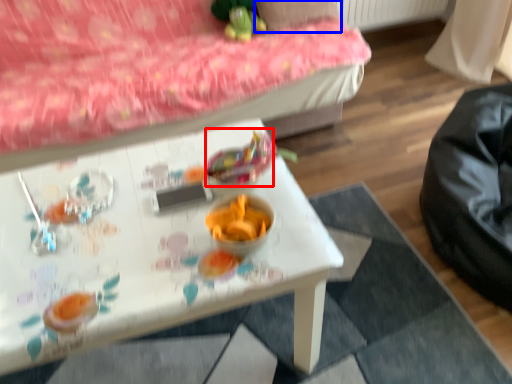
Question: Which object appears closest to the camera in this image, food (highlighted by a red box) or pillow (highlighted by a blue box)?

Choices:
 (A) food
 (B) pillow

Answer: (A)